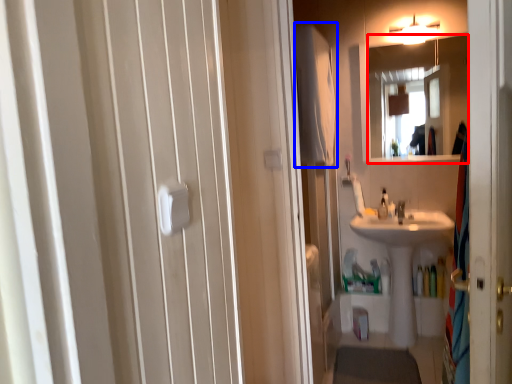
Question: Which point is further to the camera, mirror (highlighted by a red box) or bath towel (highlighted by a blue box)?

Choices:
 (A) mirror
 (B) bath towel

Answer: (A)